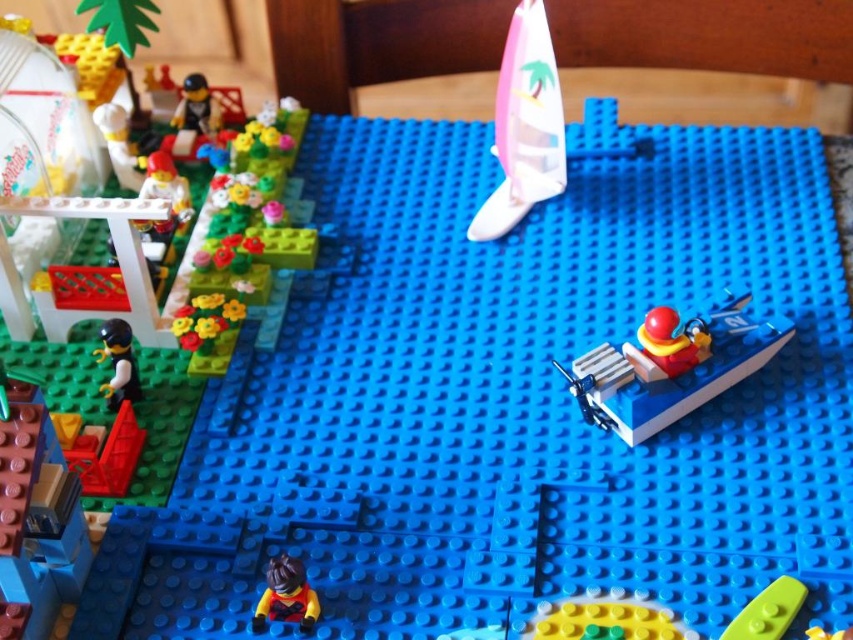
Who is lower down, white plastic sailboat at upper center or black plastic minifigure at upper left?

white plastic sailboat at upper center is lower down.

Which is behind, point (485, 237) or point (172, 118)?

The point (172, 118) is more distant.

You are a GUI agent. You are given a task and a screenshot of the screen. Output one action in this format:
    pyautogui.click(x=<x>, y=<y>)
    Task: Click on the white plastic sailboat at upper center
    
    Given the screenshot: What is the action you would take?
    pyautogui.click(x=524, y=125)

Does white plastic boat at lower right have a larger size compared to black matte minifigure at lower left?

Yes.

Between point (724, 358) and point (122, 321), which one is positioned in front?

Point (724, 358) is in front.

The height and width of the screenshot is (640, 853). Identify the location of white plastic boat at lower right. (672, 365).

Who is positioned more to the right, white plastic boat at lower right or yellow matte minifigure at lower center?

white plastic boat at lower right is more to the right.

Image resolution: width=853 pixels, height=640 pixels. In order to click on white plastic boat at lower right in this screenshot , I will do `click(672, 365)`.

Does point (679, 360) come closer to viewer compared to point (289, 582)?

No, (679, 360) is further to viewer.

The height and width of the screenshot is (640, 853). In order to click on white plastic boat at lower right in this screenshot , I will do `click(672, 365)`.